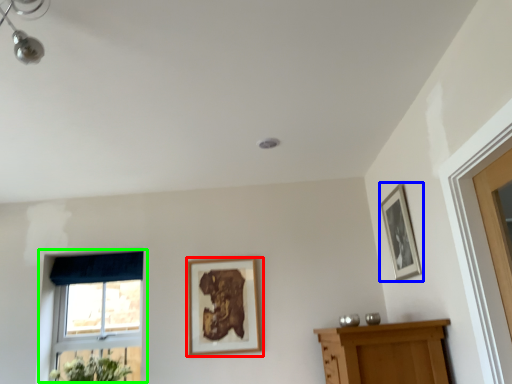
Question: Which object is the farthest from picture frame (highlighted by a red box)? Choose among these: picture frame (highlighted by a blue box) or window (highlighted by a green box).

Choices:
 (A) picture frame
 (B) window

Answer: (A)